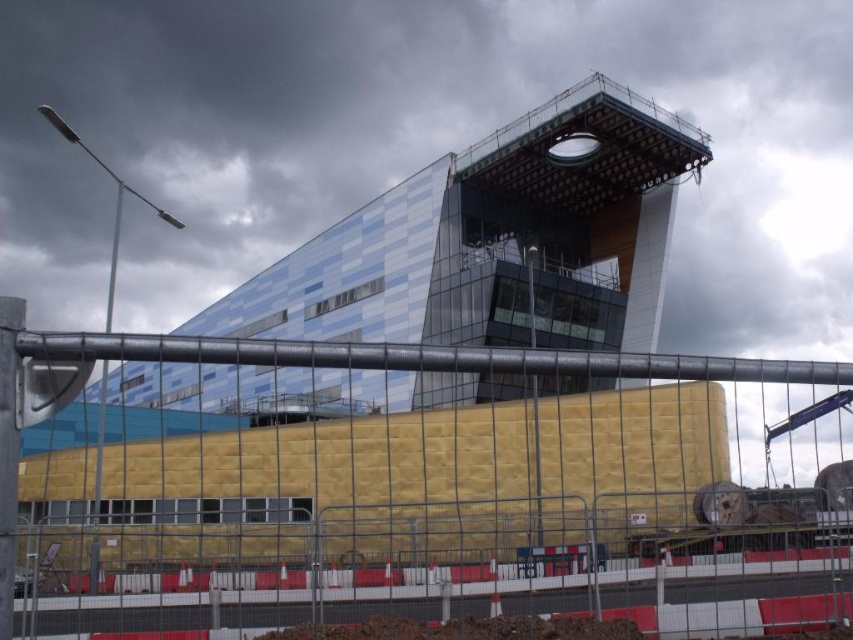
Question: Is blue glass building at upper center thinner than yellow insulation board at center?

Choices:
 (A) no
 (B) yes

Answer: (A)

Question: Which point is closer to the camera?

Choices:
 (A) blue glass building at upper center
 (B) yellow insulation board at center

Answer: (B)

Question: From the image, what is the correct spatial relationship of blue glass building at upper center in relation to yellow insulation board at center?

Choices:
 (A) below
 (B) above

Answer: (A)

Question: Among these points, which one is farthest from the camera?

Choices:
 (A) (361, 228)
 (B) (395, 369)

Answer: (A)

Question: Which point is farther from the camera taking this photo?

Choices:
 (A) (79, 339)
 (B) (453, 289)

Answer: (B)

Question: Is blue glass building at upper center bigger than yellow insulation board at center?

Choices:
 (A) no
 (B) yes

Answer: (B)